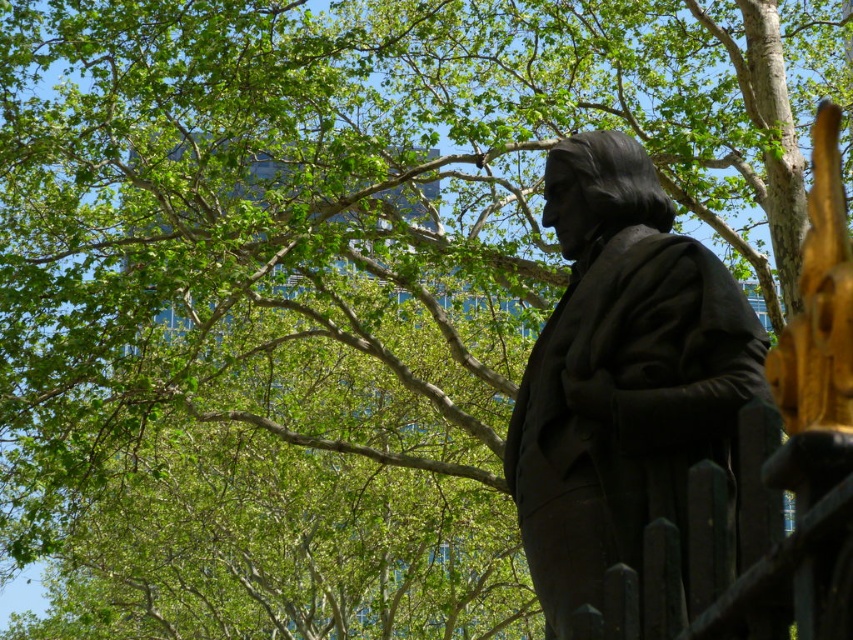
Is black polished statue at center above black metal fence at lower right?

Correct, black polished statue at center is located above black metal fence at lower right.

Between point (601, 387) and point (633, 595), which one is positioned in front?

Point (633, 595) is in front.

Between point (537, 499) and point (838, 490), which one is positioned in front?

Point (838, 490) is in front.

Locate an element on the screen. This screenshot has width=853, height=640. black polished statue at center is located at coordinates (622, 374).